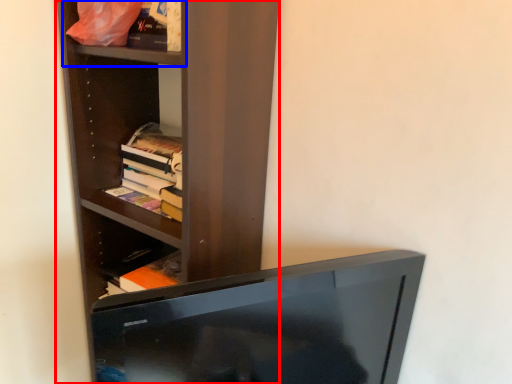
Question: Which object is closer to the camera taking this photo, shelf (highlighted by a red box) or cabinet (highlighted by a blue box)?

Choices:
 (A) shelf
 (B) cabinet

Answer: (A)